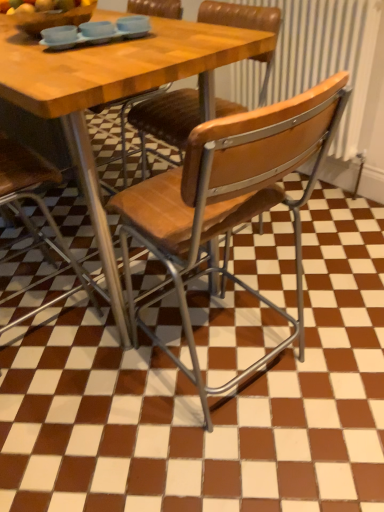
Find the location of `free location to the right of wooden seat at center, marked as the 3th chair in a right-to-left arrangement`. free location to the right of wooden seat at center, marked as the 3th chair in a right-to-left arrangement is located at coordinates (137, 316).